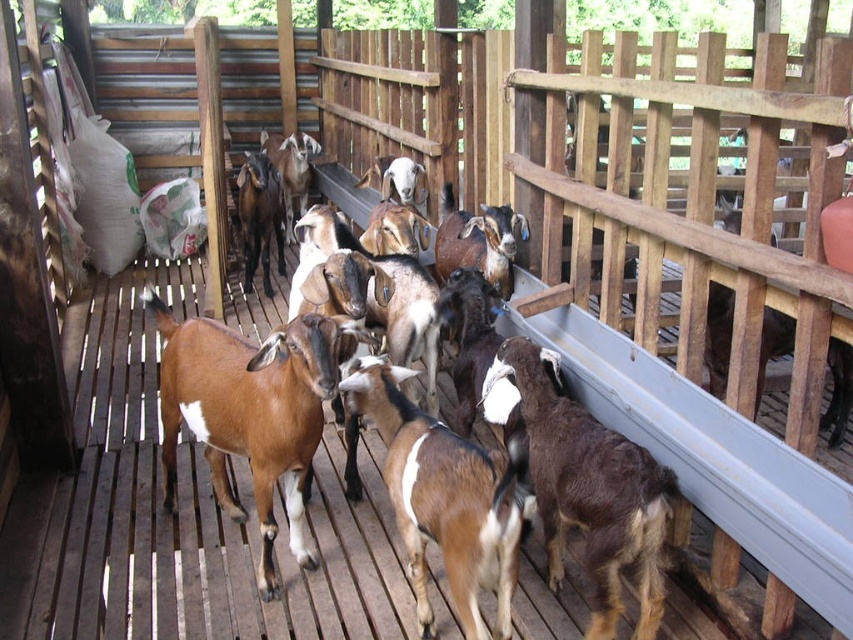
Question: Estimate the real-world distances between objects in this image. Which object is farther from the brown fuzzy goat at center?

Choices:
 (A) brown matte goat at center
 (B) brown matte/goat at center

Answer: (A)

Question: Is brown matte goat at center below brown matte/goat at center?

Choices:
 (A) yes
 (B) no

Answer: (B)

Question: Which is farther from the brown fuzzy goat at center?

Choices:
 (A) brown matte goat at center
 (B) brown matte/goat at center

Answer: (A)

Question: Considering the relative positions of brown fuzzy goat at center and brown matte/goat at center in the image provided, where is brown fuzzy goat at center located with respect to brown matte/goat at center?

Choices:
 (A) above
 (B) below

Answer: (A)

Question: Observing the image, what is the correct spatial positioning of brown matte goat at center in reference to brown matte/goat at center?

Choices:
 (A) left
 (B) right

Answer: (A)

Question: Which object appears closest to the camera in this image?

Choices:
 (A) brown fuzzy goat at center
 (B) brown matte/goat at center

Answer: (B)